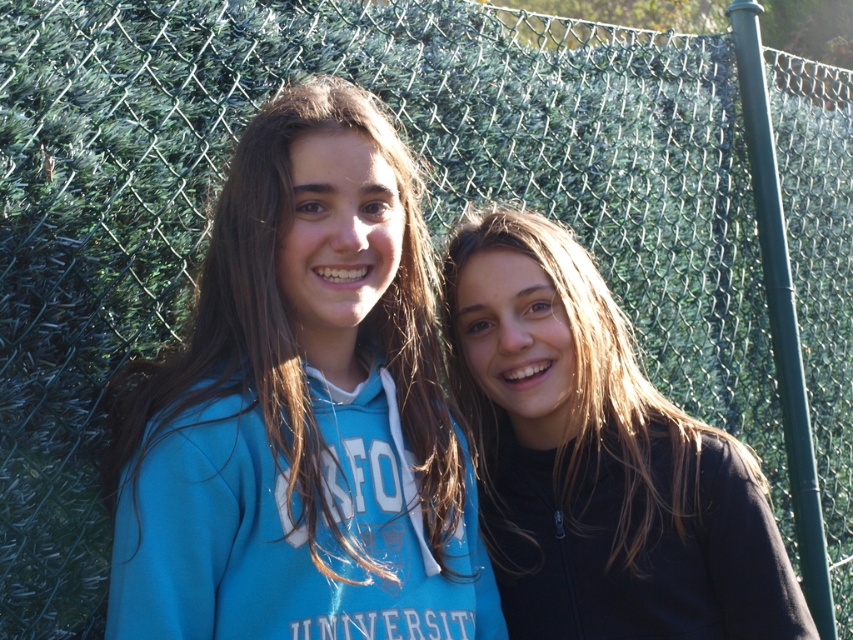
Can you confirm if blue fleece sweatshirt at center is thinner than black fleece sweatshirt at right?

No.

Is blue fleece sweatshirt at center in front of black fleece sweatshirt at right?

That is True.

Locate an element on the screen. The width and height of the screenshot is (853, 640). blue fleece sweatshirt at center is located at coordinates (292, 324).

Does point (625, 586) come closer to viewer compared to point (610, 440)?

That is True.

Is black matte jacket at right above black fleece sweatshirt at right?

Yes.

This screenshot has height=640, width=853. Describe the element at coordinates (598, 458) in the screenshot. I see `black matte jacket at right` at that location.

The image size is (853, 640). Find the location of `black matte jacket at right`. black matte jacket at right is located at coordinates (598, 458).

Who is more forward, (242, 515) or (270, 269)?

Positioned in front is point (242, 515).

Which of these two, matte blue sweatshirt at center or blue fleece sweatshirt at center, stands shorter?

matte blue sweatshirt at center

The image size is (853, 640). What do you see at coordinates (291, 531) in the screenshot? I see `matte blue sweatshirt at center` at bounding box center [291, 531].

Locate an element on the screen. matte blue sweatshirt at center is located at coordinates (291, 531).